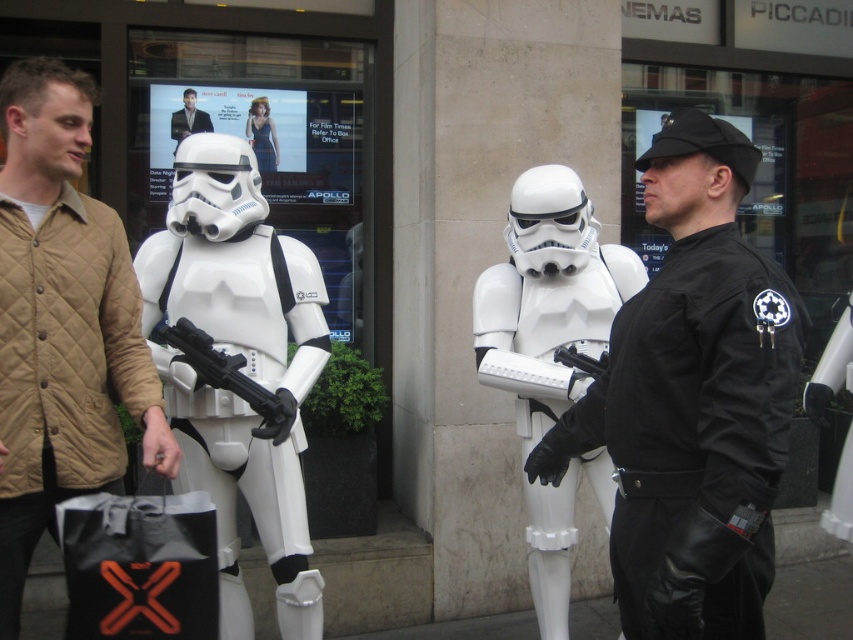
You are a photographer standing at the cinema entrance. You want to take a photo of the black leather glove at center while keeping your camera close to your body. Is there enough space between you and the glove to do this?

The black leather glove at center and camera are 3.17 meters apart, so there is sufficient space between you and the glove to take the photo while keeping your camera close to your body.

You are standing in front of the cinema and notice two people wearing a black leather jacket at center and a matte blue dress at center. Which clothing item is taller?

The black leather jacket at center is taller than the matte blue dress at center.